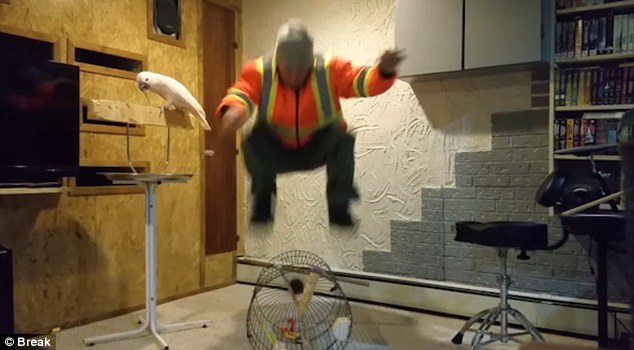
You are a GUI agent. You are given a task and a screenshot of the screen. Output one action in this format:
    pyautogui.click(x=<x>, y=<y>)
    Task: Click on the ascending grey block painting
    
    Given the screenshot: What is the action you would take?
    pyautogui.click(x=475, y=185)